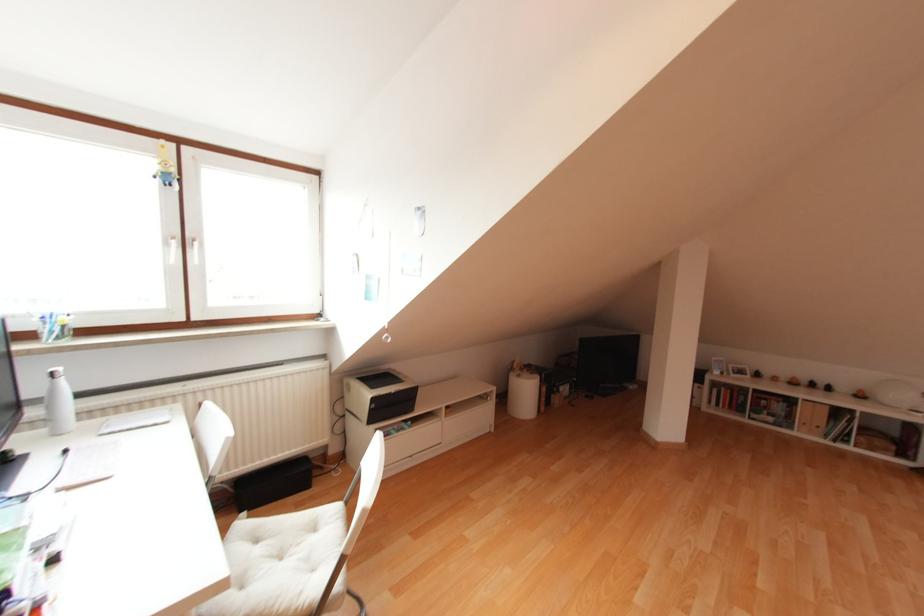
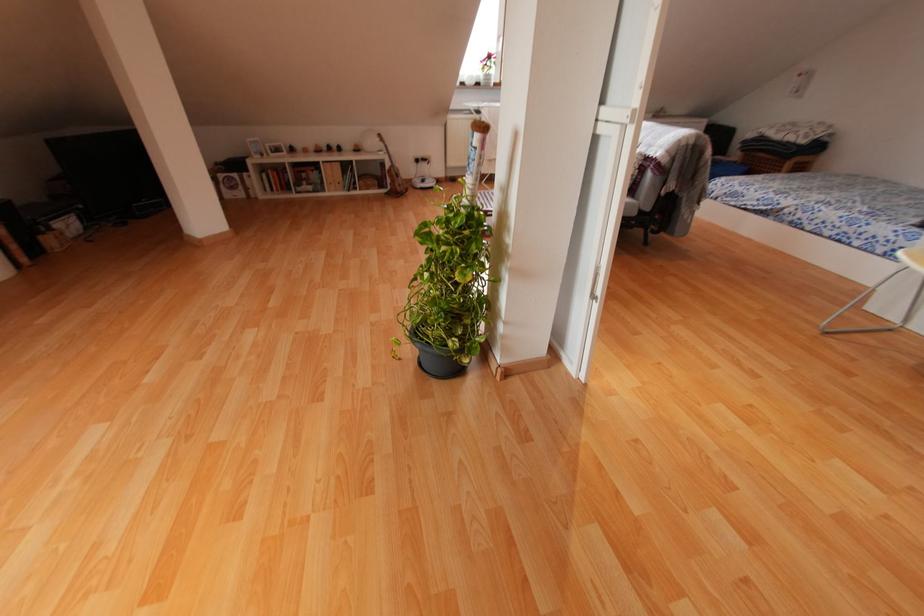
The images are taken continuously from a first-person perspective. In which direction is your viewpoint rotating?

The rotation direction of the camera is right-down.